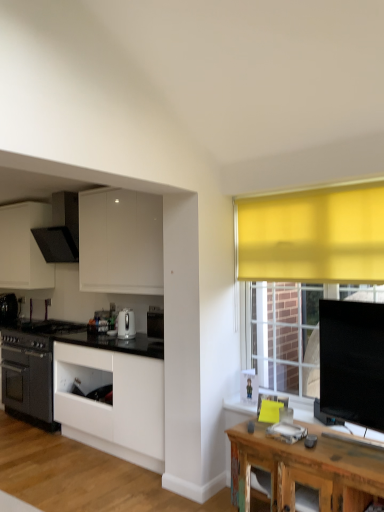
Question: Is black matte oven at left, the third kitchen appliance viewed from the top, further to camera compared to matte black range hood at upper left, the 2th kitchen appliance in the back-to-front sequence?

Choices:
 (A) no
 (B) yes

Answer: (B)

Question: Considering the relative positions of black matte oven at left, which is the 1th kitchen appliance from left to right, and matte black range hood at upper left, the 3th kitchen appliance ordered from the bottom, in the image provided, is black matte oven at left, which is the 1th kitchen appliance from left to right, to the right of matte black range hood at upper left, the 3th kitchen appliance ordered from the bottom, from the viewer's perspective?

Choices:
 (A) yes
 (B) no

Answer: (B)

Question: From a real-world perspective, is black matte oven at left, positioned as the 1th kitchen appliance in bottom-to-top order, positioned over matte black range hood at upper left, the 3th kitchen appliance ordered from the bottom, based on gravity?

Choices:
 (A) yes
 (B) no

Answer: (B)

Question: Is black matte oven at left, the third kitchen appliance viewed from the top, to the left of matte black range hood at upper left, which is the second kitchen appliance from left to right, from the viewer's perspective?

Choices:
 (A) no
 (B) yes

Answer: (B)

Question: From a real-world perspective, is black matte oven at left, the third kitchen appliance viewed from the top, physically below matte black range hood at upper left, the 2th kitchen appliance in the right-to-left sequence?

Choices:
 (A) yes
 (B) no

Answer: (A)

Question: Choose the correct answer: Is rustic wood table at lower right inside white glossy cabinet at center, positioned as the 1th cabinetry in bottom-to-top order, or outside it?

Choices:
 (A) outside
 (B) inside

Answer: (A)

Question: From the image's perspective, is rustic wood table at lower right located above or below white glossy cabinet at center, positioned as the 1th cabinetry in bottom-to-top order?

Choices:
 (A) below
 (B) above

Answer: (A)

Question: Is rustic wood table at lower right bigger or smaller than white glossy cabinet at center, the second cabinetry in the top-to-bottom sequence?

Choices:
 (A) big
 (B) small

Answer: (B)

Question: Is rustic wood table at lower right wider or thinner than white glossy cabinet at center, marked as the second cabinetry in a left-to-right arrangement?

Choices:
 (A) thin
 (B) wide

Answer: (A)

Question: Considering the positions of white glossy cabinet at center, the second cabinetry when ordered from back to front, and white glossy kettle at center, which is counted as the 2th kitchen appliance, starting from the bottom, in the image, is white glossy cabinet at center, the second cabinetry when ordered from back to front, taller or shorter than white glossy kettle at center, which is counted as the 2th kitchen appliance, starting from the bottom,?

Choices:
 (A) short
 (B) tall

Answer: (B)

Question: Is point (54, 395) closer or farther from the camera than point (117, 318)?

Choices:
 (A) farther
 (B) closer

Answer: (B)

Question: Considering their positions, is white glossy cabinet at center, the first cabinetry in the front-to-back sequence, located in front of or behind white glossy kettle at center, which is the first kitchen appliance in right-to-left order?

Choices:
 (A) behind
 (B) front

Answer: (B)

Question: Would you say white glossy cabinet at center, marked as the second cabinetry in a left-to-right arrangement, is inside or outside white glossy kettle at center, the third kitchen appliance in the left-to-right sequence?

Choices:
 (A) outside
 (B) inside

Answer: (A)

Question: Is rustic wood table at lower right situated inside matte black range hood at upper left, the 2th kitchen appliance in the right-to-left sequence, or outside?

Choices:
 (A) outside
 (B) inside

Answer: (A)

Question: From the image's perspective, is rustic wood table at lower right above or below matte black range hood at upper left, the 2th kitchen appliance from the front?

Choices:
 (A) above
 (B) below

Answer: (B)